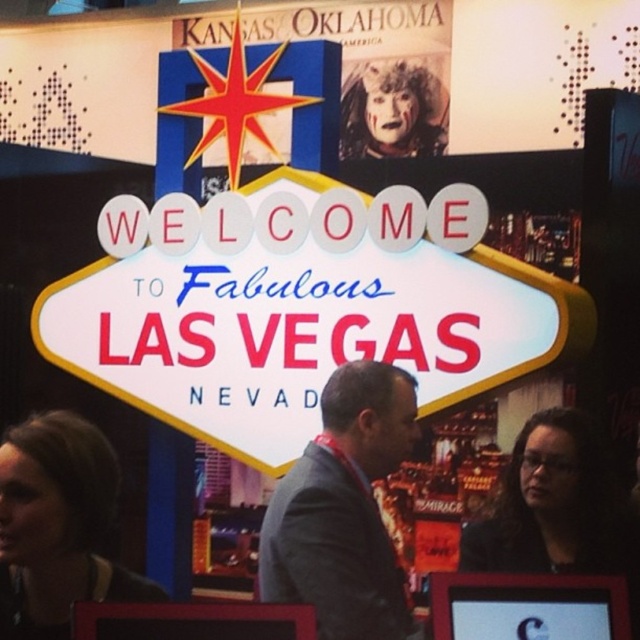
Question: Does gray wool suit at center have a smaller size compared to smooth black hair at lower left?

Choices:
 (A) yes
 (B) no

Answer: (A)

Question: Which object appears closest to the camera in this image?

Choices:
 (A) black glossy hair at lower right
 (B) white plastic sign at center
 (C) gray wool suit at center

Answer: (C)

Question: Is white plastic sign at center to the right of gray wool suit at center from the viewer's perspective?

Choices:
 (A) no
 (B) yes

Answer: (A)

Question: Which of the following is the farthest from the observer?

Choices:
 (A) white plastic sign at center
 (B) black glossy hair at lower right
 (C) gray wool suit at center

Answer: (A)

Question: From the image, what is the correct spatial relationship of gray wool suit at center in relation to black glossy hair at lower right?

Choices:
 (A) above
 (B) below

Answer: (B)

Question: Which object is closer to the camera taking this photo?

Choices:
 (A) white plastic sign at center
 (B) black glossy hair at lower right
 (C) gray wool suit at center
 (D) smooth black hair at lower left

Answer: (C)